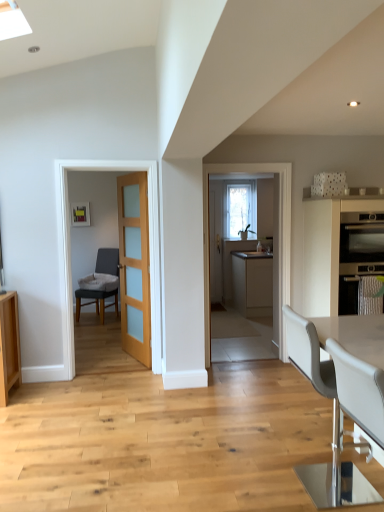
Question: From the image's perspective, is light brown wood door at center located above or below matte stainless steel oven at right?

Choices:
 (A) below
 (B) above

Answer: (A)

Question: Is light brown wood door at center spatially inside matte stainless steel oven at right, or outside of it?

Choices:
 (A) inside
 (B) outside

Answer: (B)

Question: Based on their relative distances, which object is farther from the white leather chair at lower right, the third chair from the back?

Choices:
 (A) white leather chair at lower right, the 1th chair viewed from the right
 (B) light brown wood door at center
 (C) dark gray fabric chair at left, acting as the first chair starting from the left
 (D) matte black oven at right, which is counted as the second cabinetry, starting from the back
 (E) matte beige cabinet at center, the first cabinetry when ordered from back to front

Answer: (C)

Question: Which object is the closest to the matte beige cabinet at center, which is counted as the second cabinetry, starting from the front?

Choices:
 (A) matte black oven at right, the first cabinetry in the front-to-back sequence
 (B) clear glass window at center
 (C) light brown wood door at center
 (D) white leather chair at lower right, the 2th chair positioned from the back
 (E) white leather chair at lower right, marked as the second chair in a right-to-left arrangement

Answer: (B)